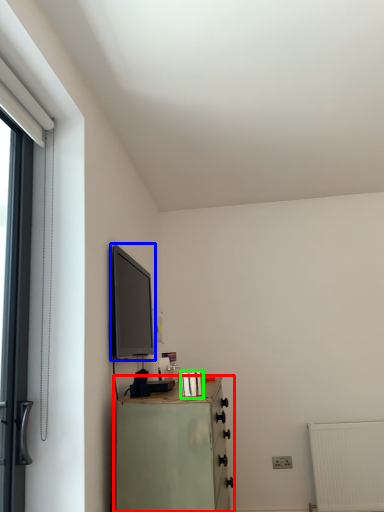
Question: Based on their relative distances, which object is farther from chest of drawers (highlighted by a red box)? Choose from window screen (highlighted by a blue box) and appliance (highlighted by a green box).

Choices:
 (A) window screen
 (B) appliance

Answer: (A)